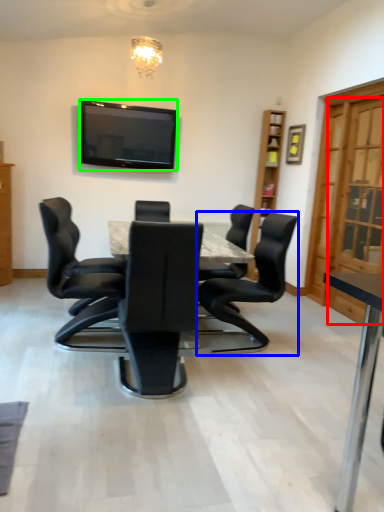
Question: Estimate the real-world distances between objects in this image. Which object is closer to glass door (highlighted by a red box), chair (highlighted by a blue box) or television (highlighted by a green box)?

Choices:
 (A) chair
 (B) television

Answer: (A)